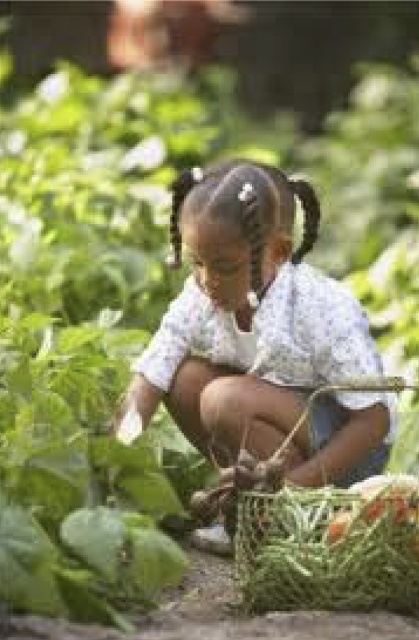
You are a photographer trying to capture the child in the garden. You want to ensure the white floral shirt at center and the green mesh basket at lower right are both in the frame. Based on their positions, which object should you focus on first to ensure both are visible?

The white floral shirt at center is positioned on the left side of the green mesh basket at lower right. To ensure both are visible, focus on the white floral shirt at center first as it is closer to the center and left of the basket, allowing the basket to remain in the frame.

From the picture: The child is trying to put all the green leafy vegetables at lower center into the green mesh basket at lower right. Will the basket be big enough?

The green mesh basket at lower right is bigger than green leafy vegetables at lower center, so yes, the basket will be big enough to hold them.

The child is trying to place the green leafy vegetables at lower center into the green mesh basket at lower right. Will the vegetables fit inside the basket based on their height?

The green mesh basket at lower right has a greater height compared to green leafy vegetables at lower center, so the vegetables will fit inside the basket since the basket is taller than the vegetables.